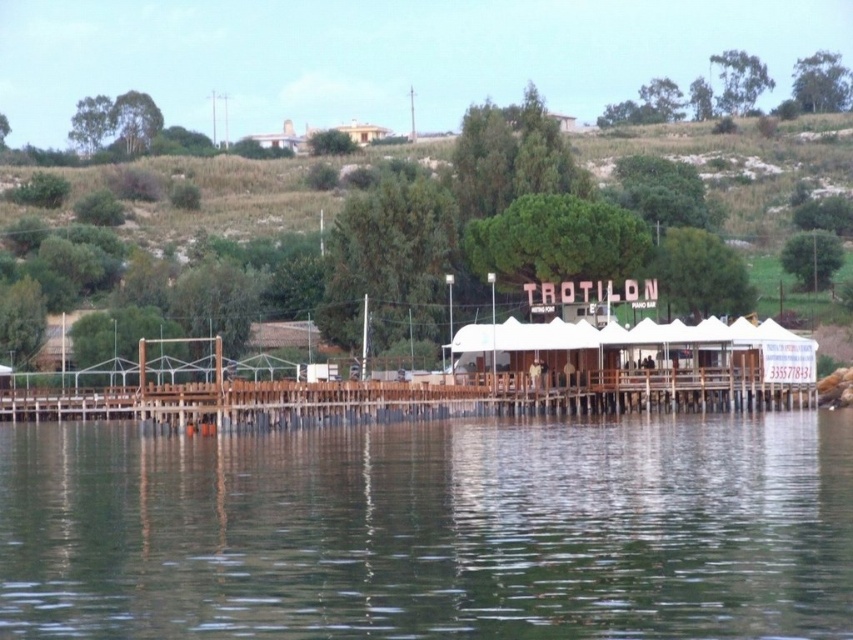
Question: Which point is farther to the camera?

Choices:
 (A) wooden dock at center
 (B) transparent water at lower center

Answer: (A)

Question: Is transparent water at lower center above wooden dock at center?

Choices:
 (A) yes
 (B) no

Answer: (B)

Question: Observing the image, what is the correct spatial positioning of transparent water at lower center in reference to wooden dock at center?

Choices:
 (A) left
 (B) right

Answer: (B)

Question: Can you confirm if transparent water at lower center is bigger than wooden dock at center?

Choices:
 (A) yes
 (B) no

Answer: (A)

Question: Which point is closer to the camera?

Choices:
 (A) wooden dock at center
 (B) transparent water at lower center

Answer: (B)